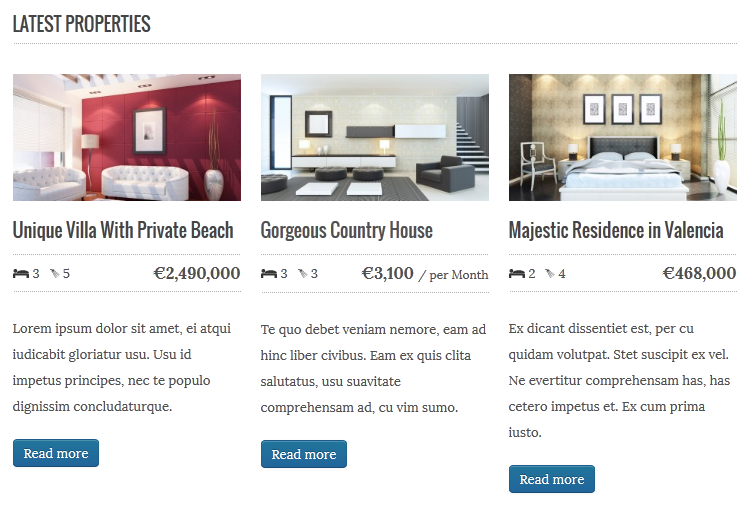
The image size is (754, 520). I want to click on chair, so click(534, 165), click(439, 172).